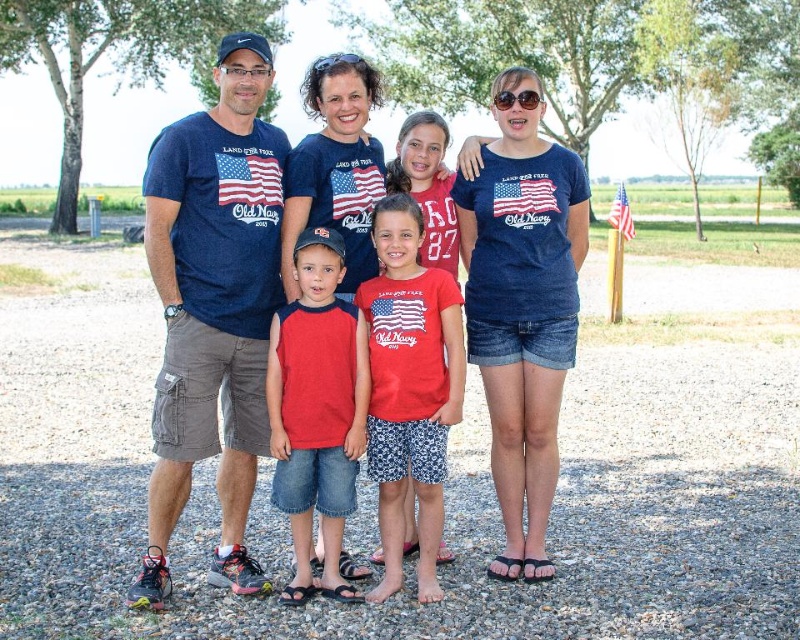
Question: Estimate the real-world distances between objects in this image. Which object is closer to the american flag fabric at center?

Choices:
 (A) red cotton shirt at center
 (B) matte american flag at center
 (C) red denim shorts at center
 (D) matte blue t-shirt at center

Answer: (C)

Question: Can you confirm if denim shorts at right is bigger than american flag fabric at center?

Choices:
 (A) no
 (B) yes

Answer: (B)

Question: Is american flag fabric at center below matte fabric flag at center?

Choices:
 (A) no
 (B) yes

Answer: (B)

Question: Does matte blue t-shirt at center have a lesser width compared to american flag fabric at center?

Choices:
 (A) yes
 (B) no

Answer: (A)

Question: Which point is farther to the camera?

Choices:
 (A) (337, 182)
 (B) (285, 257)
 (C) (616, 202)

Answer: (C)

Question: Which of the following is the closest to the observer?

Choices:
 (A) american flag at center
 (B) matte american flag at center
 (C) matte blue t-shirt at center

Answer: (C)